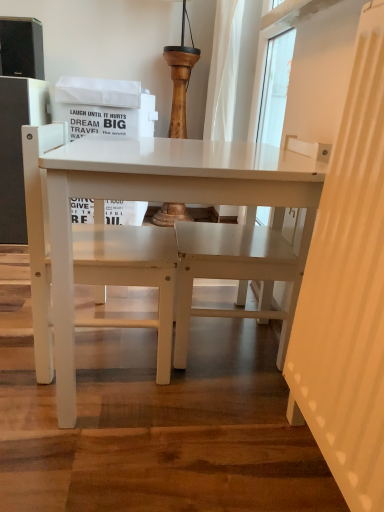
Question: Choose the correct answer: Is white matte table at center inside white matte chair at center or outside it?

Choices:
 (A) outside
 (B) inside

Answer: (A)

Question: Looking at their shapes, would you say white matte table at center is wider or thinner than white matte chair at center?

Choices:
 (A) wide
 (B) thin

Answer: (A)

Question: Relative to white matte chair at center, is white matte table at center in front or behind?

Choices:
 (A) behind
 (B) front

Answer: (B)

Question: Is white matte chair at center spatially inside white matte table at center, or outside of it?

Choices:
 (A) outside
 (B) inside

Answer: (B)

Question: Considering the positions of point (122, 262) and point (92, 192), is point (122, 262) closer or farther from the camera than point (92, 192)?

Choices:
 (A) farther
 (B) closer

Answer: (A)

Question: Looking at the image, does white matte chair at center seem bigger or smaller compared to white matte table at center?

Choices:
 (A) big
 (B) small

Answer: (B)

Question: In the image, is white matte chair at center positioned in front of or behind white matte table at center?

Choices:
 (A) front
 (B) behind

Answer: (B)